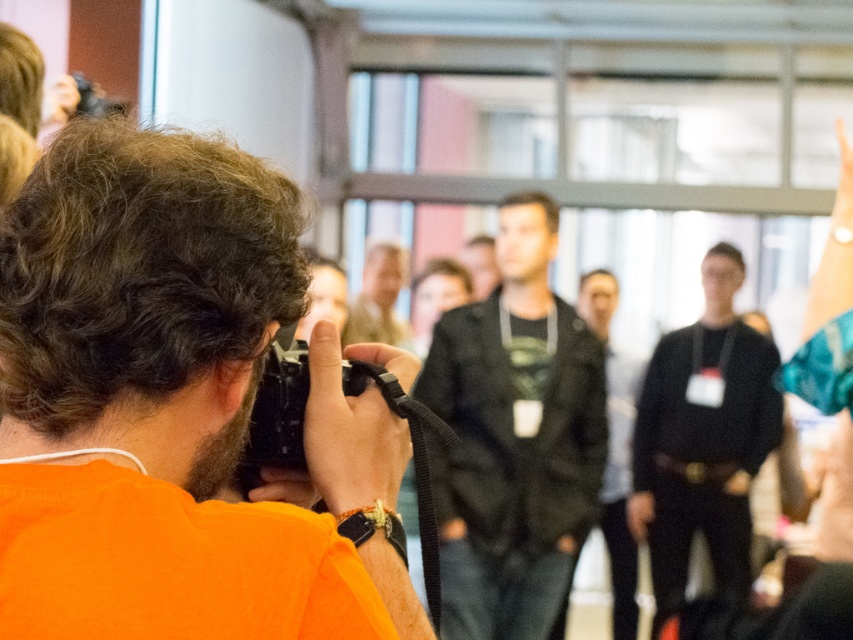
Is the position of orange fabric shirt at center less distant than that of smooth beige shirt at center?

Yes, it is in front of smooth beige shirt at center.

Is point (103, 209) positioned after point (393, 280)?

No, (103, 209) is closer to viewer.

Image resolution: width=853 pixels, height=640 pixels. What are the coordinates of `orange fabric shirt at center` in the screenshot? It's located at (143, 298).

Is black matte sweater at center to the left of dark green jacket at center from the viewer's perspective?

In fact, black matte sweater at center is to the right of dark green jacket at center.

Does black matte sweater at center appear on the right side of dark green jacket at center?

Indeed, black matte sweater at center is positioned on the right side of dark green jacket at center.

Where is `black matte sweater at center`? black matte sweater at center is located at coordinates (703, 440).

Does black matte sweater at center come in front of smooth beige shirt at center?

No, it is behind smooth beige shirt at center.

Can you confirm if black matte sweater at center is positioned below smooth beige shirt at center?

Indeed, black matte sweater at center is positioned under smooth beige shirt at center.

Between point (672, 413) and point (384, 340), which one is positioned behind?

The point (672, 413) is more distant.

Find the location of a particular element. The width and height of the screenshot is (853, 640). black matte sweater at center is located at coordinates (703, 440).